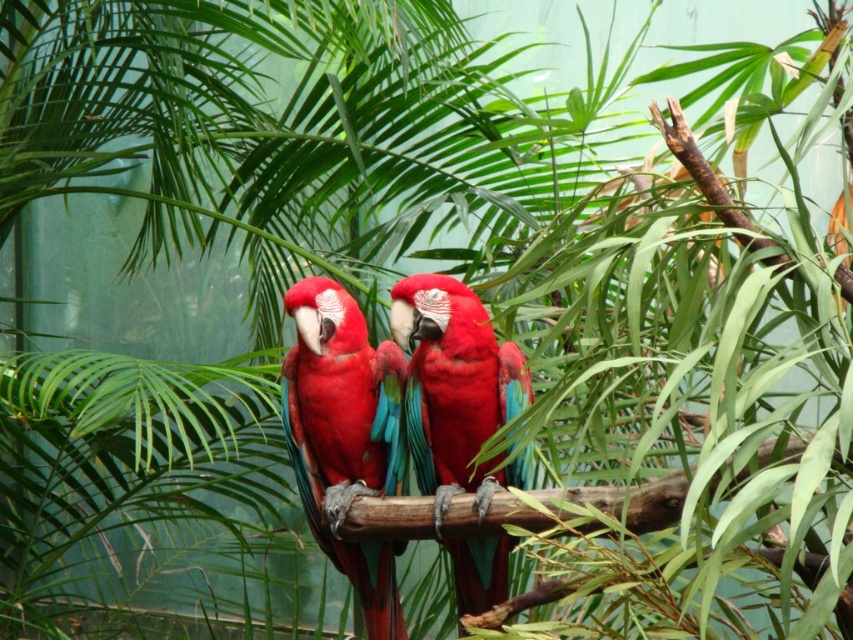
Who is more forward, (393, 397) or (469, 572)?

Point (469, 572)

Between matte red parrot at center and glossy red parrot at center, which one has more height?

With more height is matte red parrot at center.

You are a GUI agent. You are given a task and a screenshot of the screen. Output one action in this format:
    pyautogui.click(x=<x>, y=<y>)
    Task: Click on the matte red parrot at center
    
    Given the screenshot: What is the action you would take?
    pyautogui.click(x=345, y=436)

Where is `matte red parrot at center`? Image resolution: width=853 pixels, height=640 pixels. matte red parrot at center is located at coordinates (345, 436).